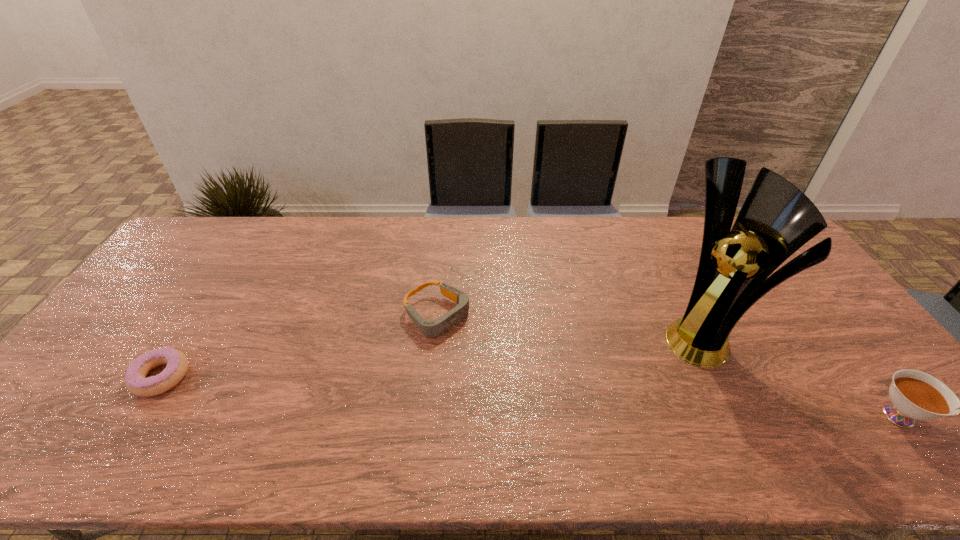
Locate an element on the screen. The width and height of the screenshot is (960, 540). empty space between the leftmost object and the third object from right to left is located at coordinates (300, 345).

I want to click on the closest object to the rightmost object, so click(776, 219).

Identify the location of object that is the closest one to the third object from right to left. This screenshot has width=960, height=540. pos(136,382).

At what (x,y) coordinates should I click in order to perform the action: click on vacant space that satisfies the following two spatial constraints: 1. on the front side of the doughnut; 2. on the side of the second tallest object with the handle. Please return your answer as a coordinate pair (x, y). This screenshot has height=540, width=960. Looking at the image, I should click on (136, 416).

Where is `vacant point that satisfies the following two spatial constraints: 1. on the front side of the goggles; 2. on the side of the rightmost object with the handle`? vacant point that satisfies the following two spatial constraints: 1. on the front side of the goggles; 2. on the side of the rightmost object with the handle is located at coordinates (427, 416).

Locate an element on the screen. vacant region that satisfies the following two spatial constraints: 1. on the back side of the goggles; 2. on the left side of the doughnut is located at coordinates coord(202,314).

The image size is (960, 540). I want to click on free location that satisfies the following two spatial constraints: 1. on the front side of the goggles; 2. on the side of the teacup with the handle, so click(x=427, y=416).